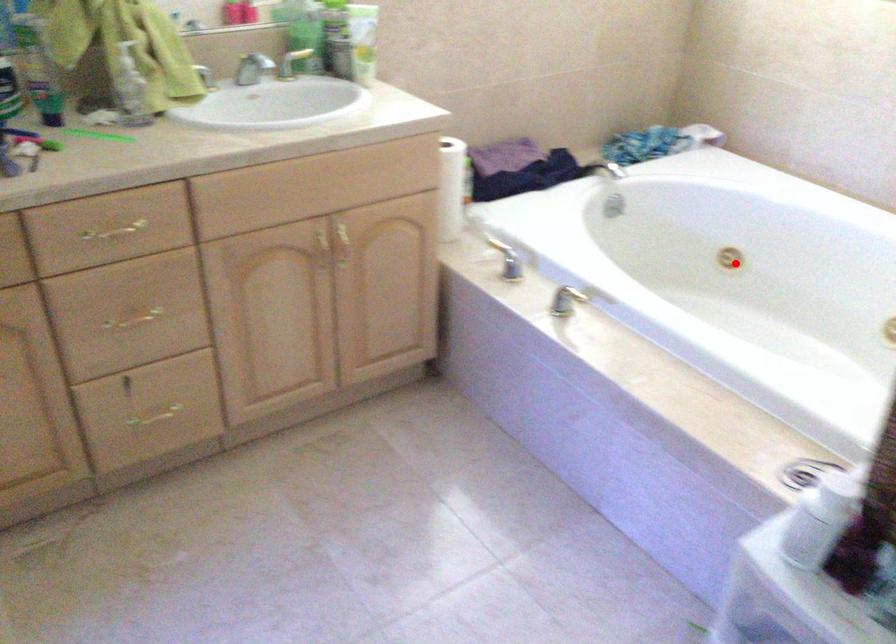
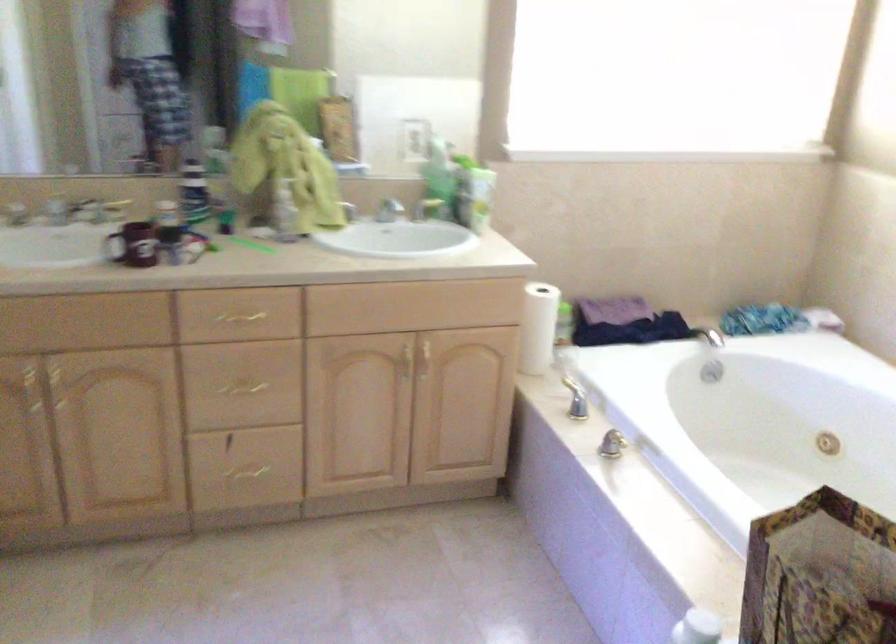
Locate, in the second image, the point that corresponds to the highlighted location in the first image.

(828, 444)